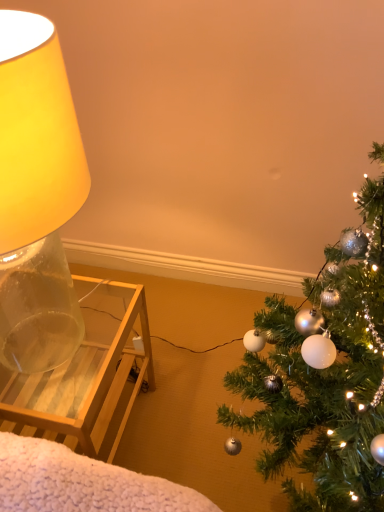
What do you see at coordinates (37, 195) in the screenshot? I see `translucent glass lamp at left` at bounding box center [37, 195].

Identify the location of translucent glass lamp at left. (x=37, y=195).

This screenshot has height=512, width=384. I want to click on shiny silver ornaments at right, so click(x=324, y=382).

In order to face shiny silver ornaments at right, should I rotate leftwards or rightwards?

It's best to rotate right around 13.393 degrees.

This screenshot has width=384, height=512. Describe the element at coordinates (324, 382) in the screenshot. I see `shiny silver ornaments at right` at that location.

Locate an element on the screen. The image size is (384, 512). translucent glass lamp at left is located at coordinates (37, 195).

Based on their positions, is shiny silver ornaments at right located to the left or right of translucent glass lamp at left?

shiny silver ornaments at right is to the right of translucent glass lamp at left.

Is shiny silver ornaments at right in front of or behind translucent glass lamp at left in the image?

Clearly, shiny silver ornaments at right is in front of translucent glass lamp at left.

Considering the points (344, 373) and (43, 226), which point is behind, point (344, 373) or point (43, 226)?

The point (344, 373) is behind.

From the image's perspective, is shiny silver ornaments at right below translucent glass lamp at left?

Correct, shiny silver ornaments at right appears lower than translucent glass lamp at left in the image.

From a real-world perspective, who is located lower, shiny silver ornaments at right or translucent glass lamp at left?

shiny silver ornaments at right.

Considering the sizes of objects shiny silver ornaments at right and translucent glass lamp at left in the image provided, who is wider, shiny silver ornaments at right or translucent glass lamp at left?

shiny silver ornaments at right is wider.

Is shiny silver ornaments at right shorter than translucent glass lamp at left?

No.

Considering the sizes of objects shiny silver ornaments at right and translucent glass lamp at left in the image provided, who is bigger, shiny silver ornaments at right or translucent glass lamp at left?

translucent glass lamp at left is bigger.

Is shiny silver ornaments at right inside the boundaries of translucent glass lamp at left, or outside?

shiny silver ornaments at right is not enclosed by translucent glass lamp at left.

Is shiny silver ornaments at right positioned far away from translucent glass lamp at left?

They are positioned close to each other.

Is translucent glass lamp at left at the back of shiny silver ornaments at right?

No, shiny silver ornaments at right is not facing the opposite direction of translucent glass lamp at left.

This screenshot has width=384, height=512. In order to click on lamp above the shiny silver ornaments at right (from the image's perspective) in this screenshot , I will do `click(37, 195)`.

Is translucent glass lamp at left to the left or to the right of shiny silver ornaments at right in the image?

translucent glass lamp at left is to the left of shiny silver ornaments at right.

Is translucent glass lamp at left positioned in front of shiny silver ornaments at right?

No, translucent glass lamp at left is further to the viewer.

Considering the points (15, 123) and (355, 450), which point is in front, point (15, 123) or point (355, 450)?

The point (15, 123) is in front.

From the picture: From the image's perspective, is translucent glass lamp at left above shiny silver ornaments at right?

Correct, translucent glass lamp at left appears higher than shiny silver ornaments at right in the image.

From a real-world perspective, is translucent glass lamp at left physically below shiny silver ornaments at right?

No, from a real-world perspective, translucent glass lamp at left is not under shiny silver ornaments at right.

Is translucent glass lamp at left wider or thinner than shiny silver ornaments at right?

translucent glass lamp at left is thinner than shiny silver ornaments at right.

Looking at this image, is translucent glass lamp at left shorter than shiny silver ornaments at right?

Correct, translucent glass lamp at left is not as tall as shiny silver ornaments at right.

Between translucent glass lamp at left and shiny silver ornaments at right, which one has smaller size?

shiny silver ornaments at right.

Would you say translucent glass lamp at left contains shiny silver ornaments at right?

No.

Are translucent glass lamp at left and shiny silver ornaments at right located far from each other?

No, translucent glass lamp at left is not far from shiny silver ornaments at right.

In the scene shown: Is translucent glass lamp at left facing away from shiny silver ornaments at right?

translucent glass lamp at left is not turned away from shiny silver ornaments at right.

Can you tell me how much translucent glass lamp at left and shiny silver ornaments at right differ in facing direction?

The angle between the facing direction of translucent glass lamp at left and the facing direction of shiny silver ornaments at right is 0.205 degrees.

Image resolution: width=384 pixels, height=512 pixels. In order to click on christmas tree below the translucent glass lamp at left (from a real-world perspective) in this screenshot , I will do `click(324, 382)`.

At what (x,y) coordinates should I click in order to perform the action: click on lamp lying on the left of shiny silver ornaments at right. Please return your answer as a coordinate pair (x, y). The image size is (384, 512). Looking at the image, I should click on (37, 195).

Find the location of a particular element. The height and width of the screenshot is (512, 384). christmas tree located underneath the translucent glass lamp at left (from a real-world perspective) is located at coordinates (324, 382).